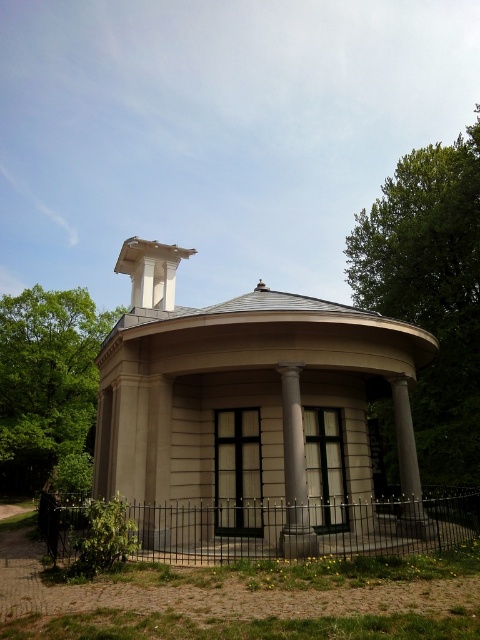
Looking at this image, you are an architect designing a new garden layout and need to know the spatial relationship between the green leafy tree at upper left and the white smooth column at center in the image. Which object is wider?

The green leafy tree at upper left is wider than the white smooth column at center.

You are an architect designing a scale model of the pavilion. You have a 10cm tall white smooth column at center and a white marble chimney at upper center. If the chimney must be exactly 15cm tall in the model, what should be the minimum height of the column to maintain the correct proportion?

The white smooth column at center is shorter than the white marble chimney at upper center. Since the chimney is scaled to 15cm, the column must be shorter than 15cm. The minimum height would be just under 15cm, but since it must be shorter, the maximum possible height while maintaining proportion would be 14.9cm or similar, depending on the scale factor. However, to ensure proportionality, the column should be scaled proportionally. If the real chimney is taller than the column, and the model chimney is 15

You are standing in front of the classical pavilion and want to determine the relative positions of two points on its roof. The first point is located at coordinates point (431, 451) and the second at point (170, 273). Which point is closer to you?

Point (170, 273) is closer to you because it is less further to the camera than point (431, 451).